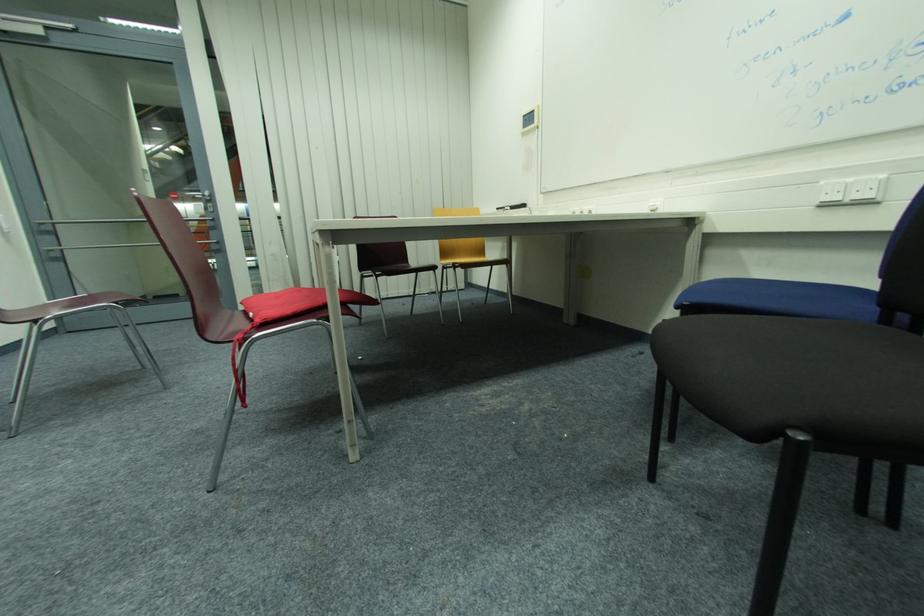
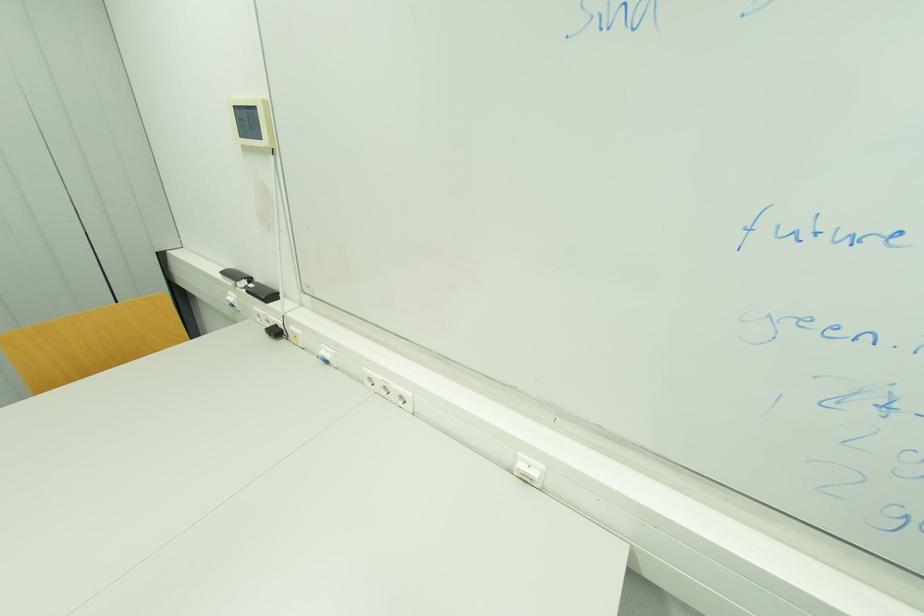
Locate, in the second image, the point that corresponds to (528,118) in the first image.

(237, 108)